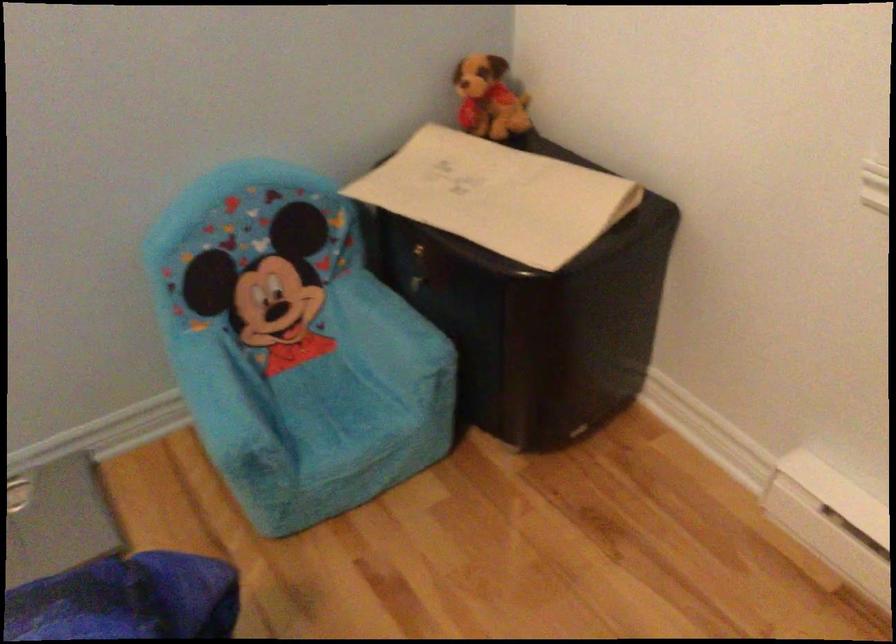
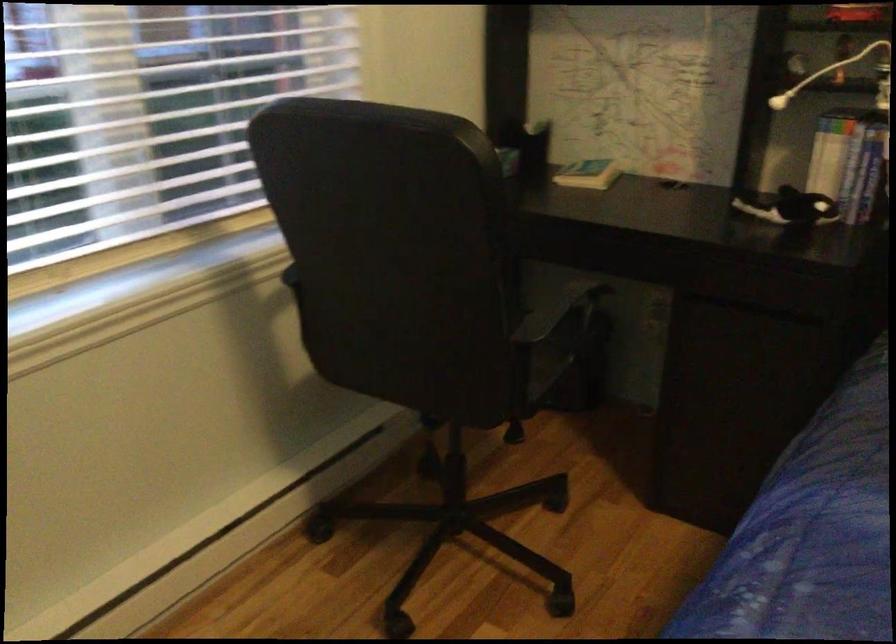
The images are taken continuously from a first-person perspective. In which direction is your viewpoint rotating?

The camera rotated toward right-down.